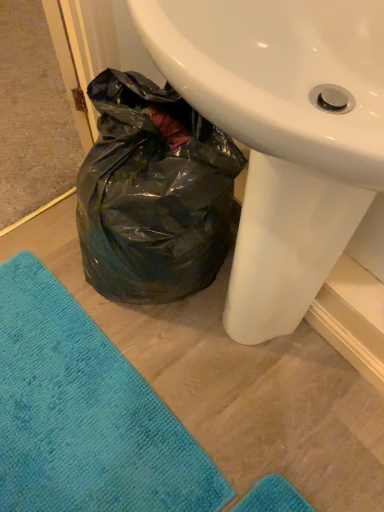
What is the approximate height of white glossy sink at center?

white glossy sink at center is 34.65 inches tall.

Locate an element on the screen. white glossy sink at center is located at coordinates (281, 134).

What do you see at coordinates (281, 134) in the screenshot? I see `white glossy sink at center` at bounding box center [281, 134].

Measure the distance between teal soft towel at lower left and camera.

They are 36.70 inches apart.

What is the approximate width of teal soft towel at lower left?

teal soft towel at lower left is 35.34 inches in width.

At what (x,y) coordinates should I click in order to perform the action: click on teal soft towel at lower left. Please return your answer as a coordinate pair (x, y). Looking at the image, I should click on point(85,414).

Describe the element at coordinates (85, 414) in the screenshot. This screenshot has height=512, width=384. I see `teal soft towel at lower left` at that location.

At what (x,y) coordinates should I click in order to perform the action: click on white glossy sink at center. Please return your answer as a coordinate pair (x, y). Looking at the image, I should click on (281, 134).

Does teal soft towel at lower left appear on the left side of white glossy sink at center?

Yes.

Considering the positions of objects teal soft towel at lower left and white glossy sink at center in the image provided, who is behind, teal soft towel at lower left or white glossy sink at center?

teal soft towel at lower left is behind.

Does point (79, 387) come closer to viewer compared to point (169, 80)?

No, (79, 387) is further to viewer.

From the image's perspective, does teal soft towel at lower left appear higher than white glossy sink at center?

No, from the image's perspective, teal soft towel at lower left is not above white glossy sink at center.

From a real-world perspective, is teal soft towel at lower left under white glossy sink at center?

Yes, from a real-world perspective, teal soft towel at lower left is beneath white glossy sink at center.

Is teal soft towel at lower left wider than white glossy sink at center?

Indeed, teal soft towel at lower left has a greater width compared to white glossy sink at center.

Is teal soft towel at lower left taller than white glossy sink at center?

No.

Does teal soft towel at lower left have a larger size compared to white glossy sink at center?

Incorrect, teal soft towel at lower left is not larger than white glossy sink at center.

Can we say teal soft towel at lower left lies outside white glossy sink at center?

Yes, teal soft towel at lower left is located beyond the bounds of white glossy sink at center.

Is teal soft towel at lower left not close to white glossy sink at center?

teal soft towel at lower left is actually quite close to white glossy sink at center.

Is teal soft towel at lower left positioned with its back to white glossy sink at center?

No.

How different are the orientations of teal soft towel at lower left and white glossy sink at center in degrees?

teal soft towel at lower left and white glossy sink at center are facing 88.1 degrees away from each other.

Find the location of `sink above the teal soft towel at lower left (from a real-world perspective)`. sink above the teal soft towel at lower left (from a real-world perspective) is located at coordinates (281, 134).

Considering the positions of objects white glossy sink at center and teal soft towel at lower left in the image provided, who is more to the right, white glossy sink at center or teal soft towel at lower left?

white glossy sink at center.

Considering the relative positions of white glossy sink at center and teal soft towel at lower left in the image provided, is white glossy sink at center behind teal soft towel at lower left?

No, it is not.

Is point (254, 275) positioned before point (14, 371)?

Yes, it is in front of point (14, 371).

From the image's perspective, is white glossy sink at center above or below teal soft towel at lower left?

Clearly, from the image's perspective, white glossy sink at center is above teal soft towel at lower left.

From a real-world perspective, relative to teal soft towel at lower left, is white glossy sink at center vertically above or below?

white glossy sink at center is above teal soft towel at lower left.

Between white glossy sink at center and teal soft towel at lower left, which one has smaller width?

white glossy sink at center is thinner.

From their relative heights in the image, would you say white glossy sink at center is taller or shorter than teal soft towel at lower left?

Considering their sizes, white glossy sink at center has more height than teal soft towel at lower left.

Can you confirm if white glossy sink at center is smaller than teal soft towel at lower left?

No.

Is white glossy sink at center located outside teal soft towel at lower left?

Absolutely, white glossy sink at center is external to teal soft towel at lower left.

Based on the photo, are white glossy sink at center and teal soft towel at lower left located far from each other?

No, there isn't a large distance between white glossy sink at center and teal soft towel at lower left.

Is white glossy sink at center aimed at teal soft towel at lower left?

Yes, white glossy sink at center faces towards teal soft towel at lower left.

From the picture: What's the angular difference between white glossy sink at center and teal soft towel at lower left's facing directions?

The facing directions of white glossy sink at center and teal soft towel at lower left are 88.1 degrees apart.

Measure the distance between white glossy sink at center and teal soft towel at lower left.

20.59 inches.

I want to click on sink above the teal soft towel at lower left (from a real-world perspective), so click(x=281, y=134).

In the image, there is a white glossy sink at center. At what (x,y) coordinates should I click in order to perform the action: click on beach towel below it (from the image's perspective). Please return your answer as a coordinate pair (x, y). Image resolution: width=384 pixels, height=512 pixels. Looking at the image, I should click on (85, 414).

Where is `sink that is in front of the teal soft towel at lower left`? This screenshot has width=384, height=512. sink that is in front of the teal soft towel at lower left is located at coordinates (281, 134).